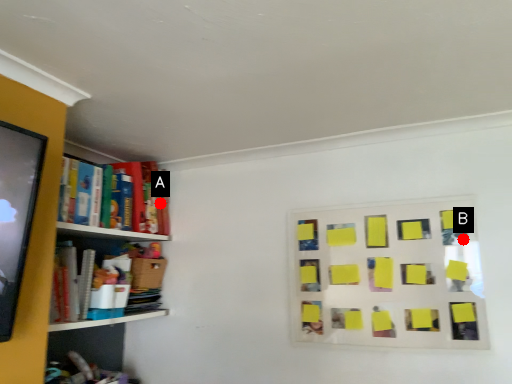
Question: Two points are circled on the image, labeled by A and B beside each circle. Which point is further to the camera?

Choices:
 (A) A is further
 (B) B is further

Answer: (A)